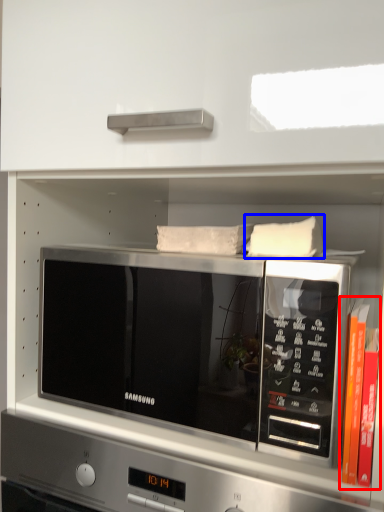
Question: Which point is further to the camera, book (highlighted by a red box) or pillow (highlighted by a blue box)?

Choices:
 (A) book
 (B) pillow

Answer: (B)